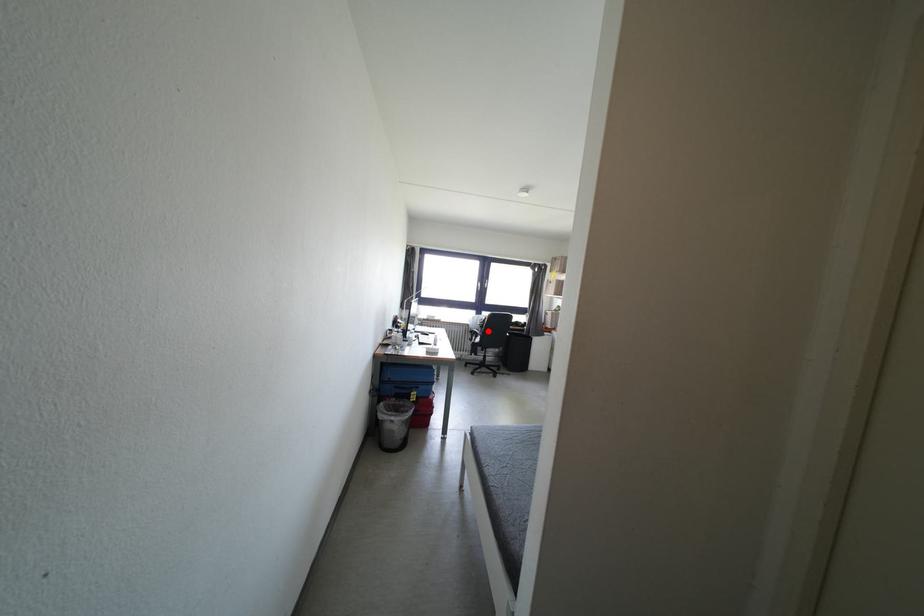
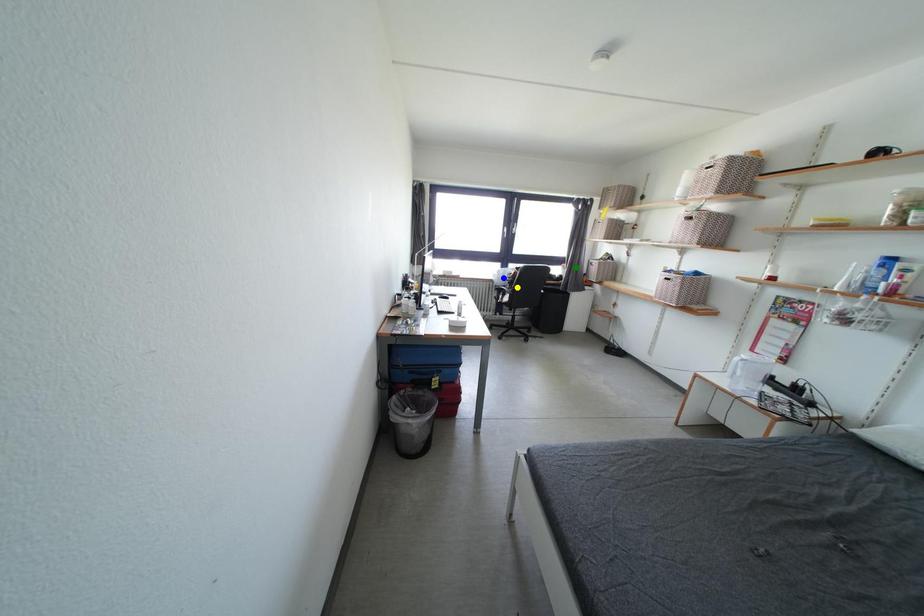
Question: I am providing you with two images of the same scene from different viewpoints. A red point is marked on the first image. You are given multiple points on the second image. Which spot in image 2 lines up with the point in image 1?

Choices:
 (A) green point
 (B) yellow point
 (C) blue point

Answer: (B)